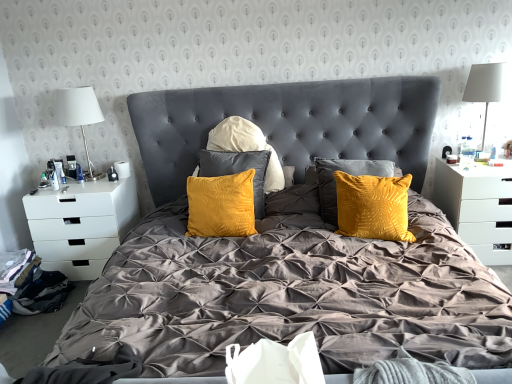
Question: From a real-world perspective, does white glossy nightstand at right, which is the 1th nightstand from right to left, stand above black fabric at lower left?

Choices:
 (A) yes
 (B) no

Answer: (A)

Question: From the image's perspective, is white glossy nightstand at right, which is the 1th nightstand from right to left, below black fabric at lower left?

Choices:
 (A) yes
 (B) no

Answer: (B)

Question: Does white glossy nightstand at right, which is the 1th nightstand from right to left, have a greater width compared to black fabric at lower left?

Choices:
 (A) no
 (B) yes

Answer: (B)

Question: From the image's perspective, is white glossy nightstand at right, which ranks as the 2th nightstand in left-to-right order, located above black fabric at lower left?

Choices:
 (A) no
 (B) yes

Answer: (B)

Question: Does white glossy nightstand at right, which is the 1th nightstand from right to left, turn towards black fabric at lower left?

Choices:
 (A) no
 (B) yes

Answer: (A)

Question: Considering the relative positions of white glossy nightstand at right, which ranks as the 2th nightstand in left-to-right order, and black fabric at lower left in the image provided, is white glossy nightstand at right, which ranks as the 2th nightstand in left-to-right order, to the left of black fabric at lower left from the viewer's perspective?

Choices:
 (A) yes
 (B) no

Answer: (B)

Question: Is white fabric lampshade at left, the 2th table lamp viewed from the right, wider than black fabric at lower left?

Choices:
 (A) no
 (B) yes

Answer: (A)

Question: Considering the relative sizes of white fabric lampshade at left, which is counted as the first table lamp, starting from the left, and black fabric at lower left in the image provided, is white fabric lampshade at left, which is counted as the first table lamp, starting from the left, taller than black fabric at lower left?

Choices:
 (A) yes
 (B) no

Answer: (A)

Question: Is white fabric lampshade at left, which is counted as the first table lamp, starting from the left, aimed at black fabric at lower left?

Choices:
 (A) no
 (B) yes

Answer: (A)

Question: Is white fabric lampshade at left, the 2th table lamp viewed from the right, positioned with its back to black fabric at lower left?

Choices:
 (A) no
 (B) yes

Answer: (A)

Question: Is white fabric lampshade at left, the 2th table lamp viewed from the right, bigger than black fabric at lower left?

Choices:
 (A) yes
 (B) no

Answer: (A)

Question: From a real-world perspective, is white fabric lampshade at left, which is counted as the first table lamp, starting from the left, on top of black fabric at lower left?

Choices:
 (A) no
 (B) yes

Answer: (B)

Question: Is black fabric at lower left in contact with velvet yellow pillows at center?

Choices:
 (A) yes
 (B) no

Answer: (B)